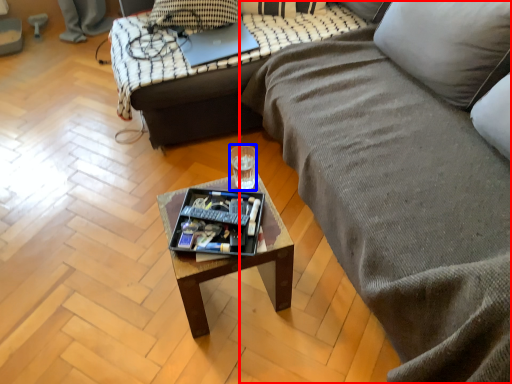
Question: Which object appears closest to the camera in this image, studio couch (highlighted by a red box) or coffee cup (highlighted by a blue box)?

Choices:
 (A) studio couch
 (B) coffee cup

Answer: (A)